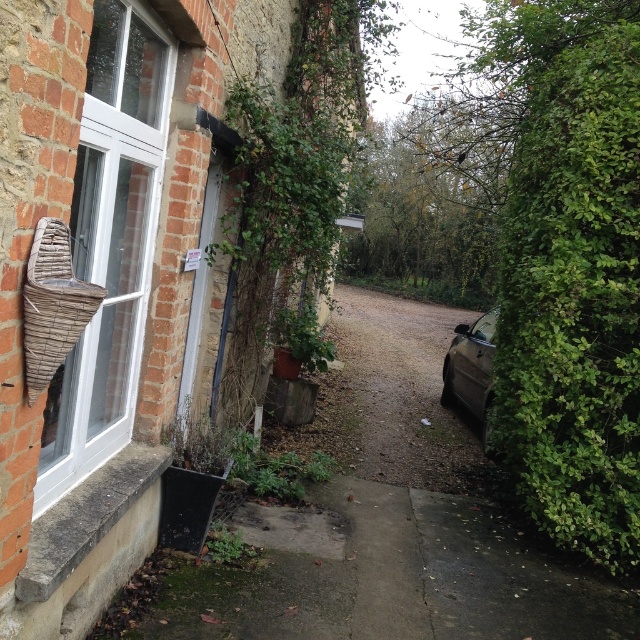
You are a gardener standing in front of the brick building. You notice the green leafy hedge at right and the metallic gray car at right. Which object is closer to you?

The green leafy hedge at right is closer to you because it is in front of the metallic gray car at right.

You are driving a metallic gray car at right and want to park it on the brown gravel driveway at center. Can the driveway accommodate the car?

The brown gravel driveway at center might be wider than metallic gray car at right, so it is possible that the driveway can accommodate the car, but there is uncertainty due to the comparative width.

You are a delivery person trying to park your metallic gray car at right in the brown gravel driveway at center. Based on the scene, can you fit the car into the driveway?

The brown gravel driveway at center is located above the metallic gray car at right, which means the driveway is not positioned in a way that allows the car to park there. You might need to look for another parking spot.